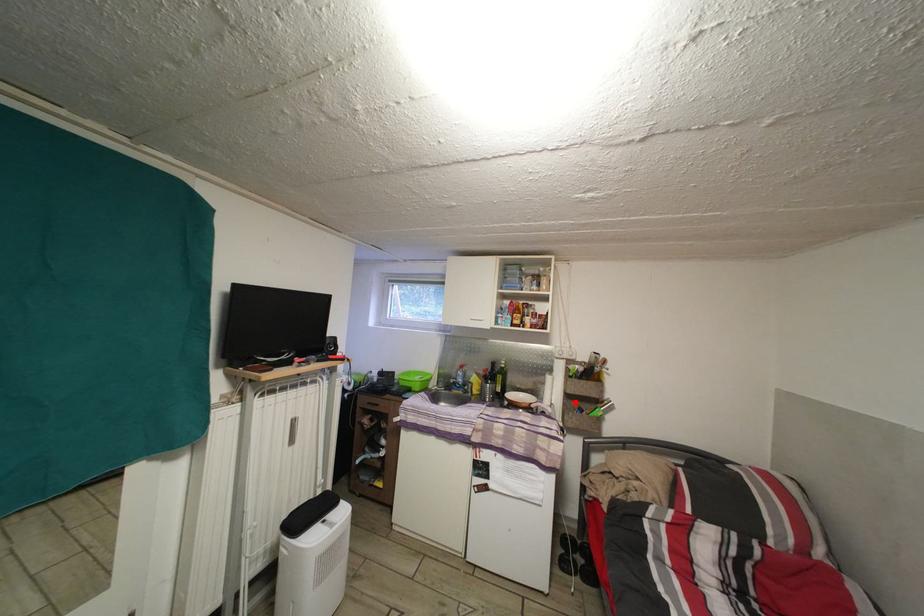
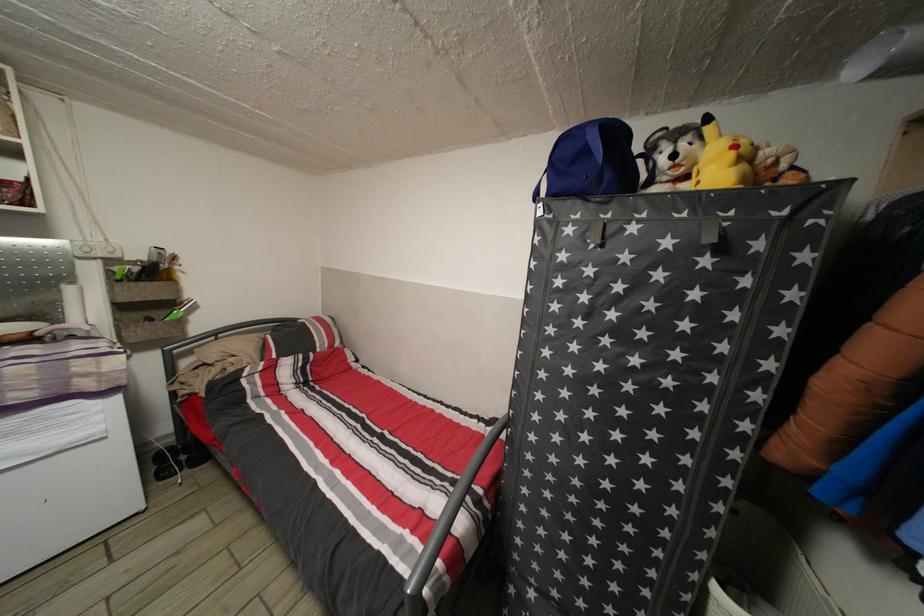
The point at the highlighted location is marked in the first image. Where is the corresponding point in the second image?

(128, 314)